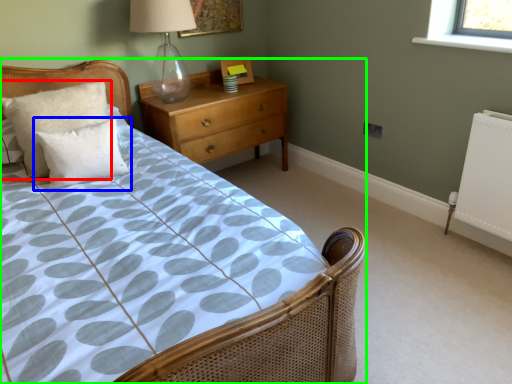
Question: Which object is positioned farthest from pillow (highlighted by a red box)? Select from pillow (highlighted by a blue box) and bed (highlighted by a green box).

Choices:
 (A) pillow
 (B) bed

Answer: (B)